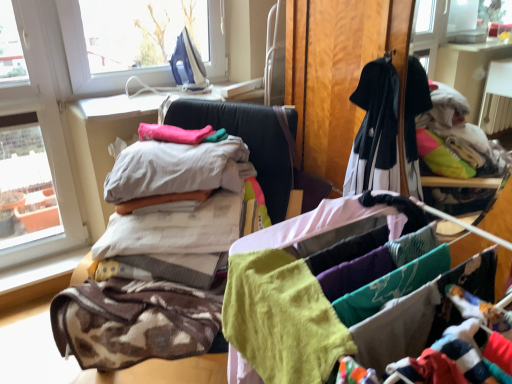
Question: Which direction should I rotate to look at white cotton sheets at center, which is counted as the 3th baby clothe, starting from the front?

Choices:
 (A) left
 (B) right

Answer: (A)

Question: Is soft cotton clothes at center, the second baby clothe viewed from the back, located within pink fabric at center, which ranks as the fifth baby clothe in front-to-back order?

Choices:
 (A) yes
 (B) no

Answer: (B)

Question: Is pink fabric at center, which ranks as the fifth baby clothe in front-to-back order, outside soft cotton clothes at center, the fourth baby clothe viewed from the front?

Choices:
 (A) no
 (B) yes

Answer: (A)

Question: Is pink fabric at center, which ranks as the fifth baby clothe in front-to-back order, wider than soft cotton clothes at center, the second baby clothe viewed from the back?

Choices:
 (A) no
 (B) yes

Answer: (A)

Question: Can you confirm if pink fabric at center, the 1th baby clothe in the back-to-front sequence, is shorter than soft cotton clothes at center, the second baby clothe viewed from the back?

Choices:
 (A) yes
 (B) no

Answer: (A)

Question: Is pink fabric at center, which ranks as the fifth baby clothe in front-to-back order, looking in the opposite direction of soft cotton clothes at center, the fourth baby clothe viewed from the front?

Choices:
 (A) no
 (B) yes

Answer: (A)

Question: Is pink fabric at center, the 1th baby clothe in the back-to-front sequence, further to camera compared to soft cotton clothes at center, the second baby clothe viewed from the back?

Choices:
 (A) yes
 (B) no

Answer: (A)

Question: Is soft cotton towel at center surrounded by white cotton sheets at center, which is counted as the 3th baby clothe, starting from the front?

Choices:
 (A) no
 (B) yes

Answer: (A)

Question: Is white cotton sheets at center, which appears as the third baby clothe when viewed from the back, aimed at soft cotton towel at center?

Choices:
 (A) no
 (B) yes

Answer: (A)

Question: Is white cotton sheets at center, which is counted as the 3th baby clothe, starting from the front, positioned in front of soft cotton towel at center?

Choices:
 (A) no
 (B) yes

Answer: (A)

Question: Does white cotton sheets at center, which is counted as the 3th baby clothe, starting from the front, appear on the right side of soft cotton towel at center?

Choices:
 (A) yes
 (B) no

Answer: (B)

Question: Is white cotton sheets at center, which appears as the third baby clothe when viewed from the back, positioned beyond the bounds of soft cotton towel at center?

Choices:
 (A) no
 (B) yes

Answer: (B)

Question: Considering the relative sizes of white cotton sheets at center, which is counted as the 3th baby clothe, starting from the front, and soft cotton towel at center in the image provided, is white cotton sheets at center, which is counted as the 3th baby clothe, starting from the front, shorter than soft cotton towel at center?

Choices:
 (A) yes
 (B) no

Answer: (A)

Question: Is the position of white cotton bed at center less distant than that of brown textured blanket at left, which is counted as the 4th baby clothe, starting from the back?

Choices:
 (A) yes
 (B) no

Answer: (A)